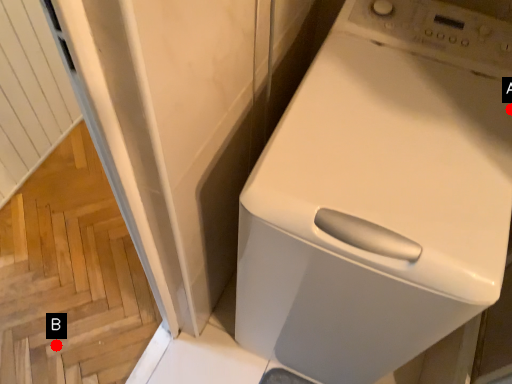
Question: Two points are circled on the image, labeled by A and B beside each circle. Which point is closer to the camera?

Choices:
 (A) A is closer
 (B) B is closer

Answer: (A)